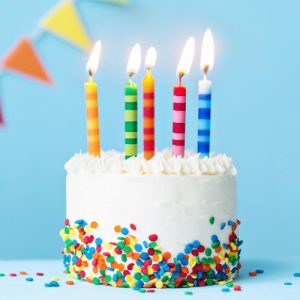
Identify the location of birthday candle flames. This screenshot has width=300, height=300. (92, 70), (131, 71), (149, 68), (181, 75), (205, 69).